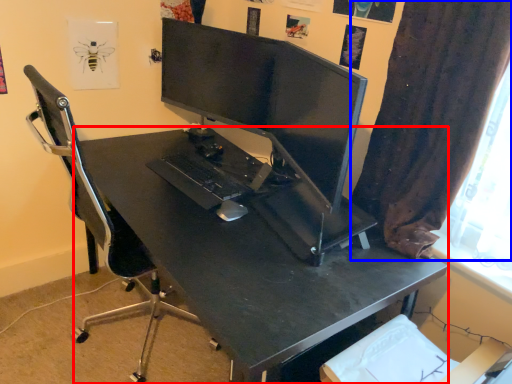
Question: Which point is closer to the camera, desk (highlighted by a red box) or curtain (highlighted by a blue box)?

Choices:
 (A) desk
 (B) curtain

Answer: (B)